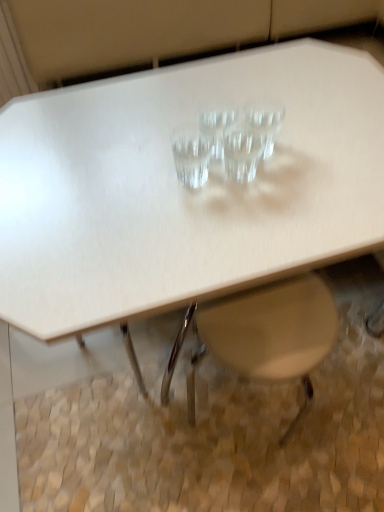
The height and width of the screenshot is (512, 384). In order to click on free space to the left of white plastic swivel chair at lower center in this screenshot , I will do `click(123, 426)`.